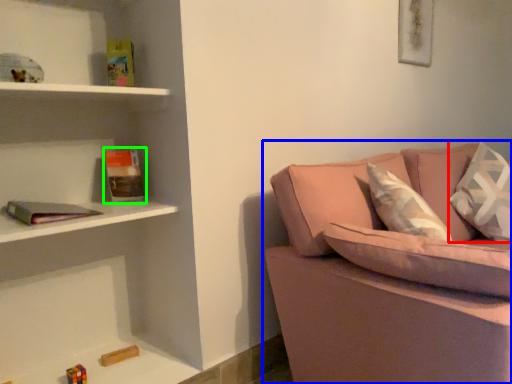
Question: Considering the real-world distances, which object is closest to pillow (highlighted by a red box)? studio couch (highlighted by a blue box) or book (highlighted by a green box).

Choices:
 (A) studio couch
 (B) book

Answer: (A)